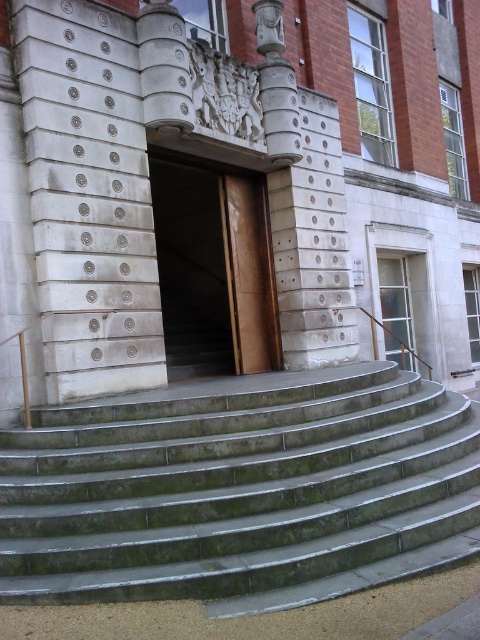
From the picture: You are standing at the entrance of the building and want to move from point A to point B. If point A is at coordinate point (x=156, y=484) and point B is at coordinate point (x=279, y=368), which direction should you move to reach point B from point A?

To move from point A at coordinate point (x=156, y=484) to point B at coordinate point (x=279, y=368), you should move towards the left and upwards since point B is located to the left and above point A.

You are a delivery person trying to reach the brown wooden door at center. The green marble stairs at center are blocking your path. Can you go around them to reach the door?

The green marble stairs at center are in front of the brown wooden door at center, so you cannot go around them to reach the door since they are directly blocking the path.

You are a delivery person trying to reach the brown wooden door at center. The green marble stairs at center are in your way. Can you go around them to reach the door?

The green marble stairs at center are located below the brown wooden door at center, so you can go around them by approaching from the sides to reach the door.